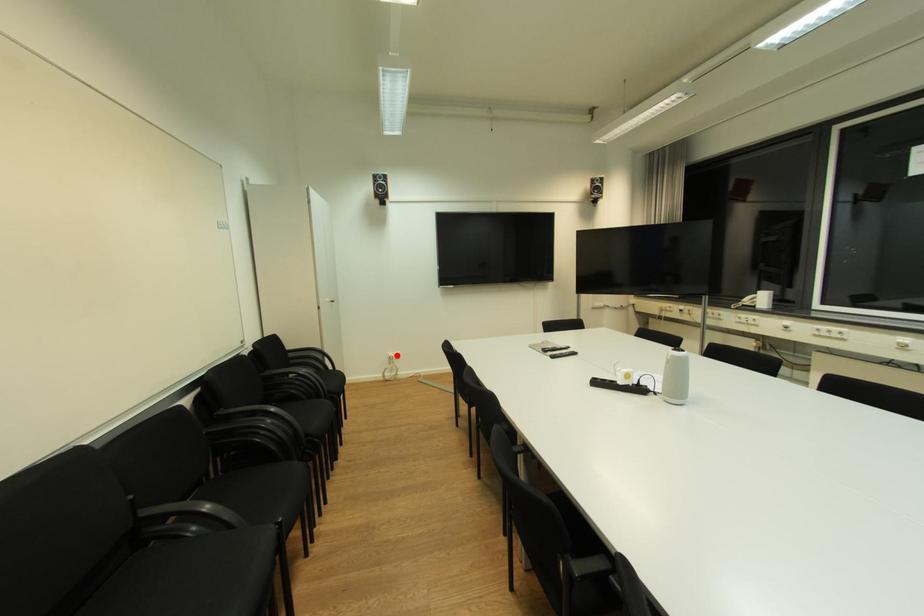
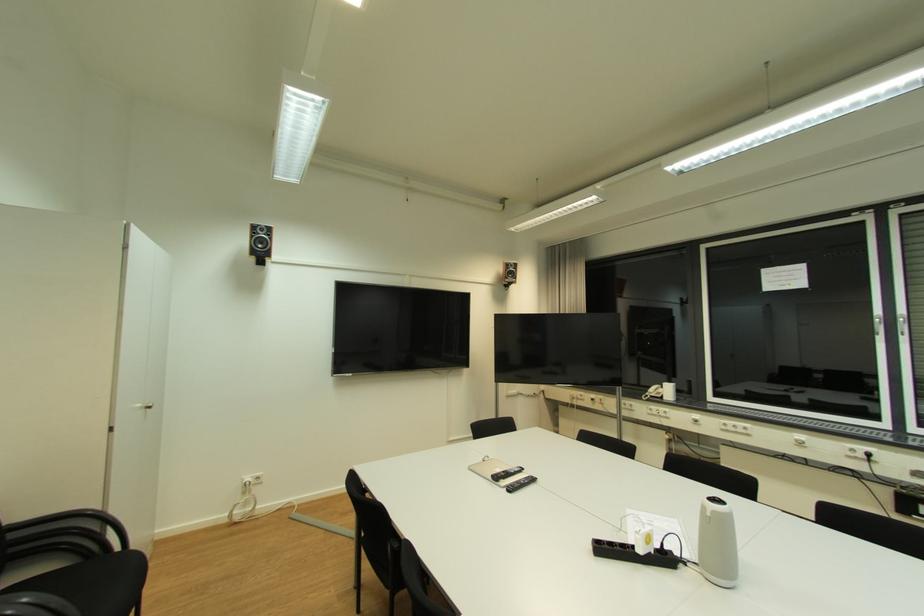
Question: I am providing you with two images of the same scene from different viewpoints. Image1 has a red point marked. In image2, the corresponding 3D location appears at what relative position? Reply with the corresponding letter.

Choices:
 (A) Closer
 (B) Farther

Answer: (B)